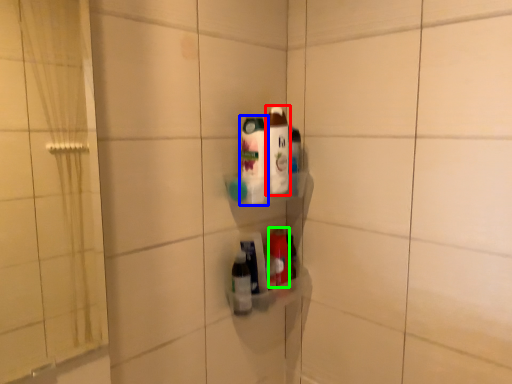
Question: Estimate the real-world distances between objects in this image. Which object is closer to bottle (highlighted by a red box), bottle (highlighted by a blue box) or bottle (highlighted by a green box)?

Choices:
 (A) bottle
 (B) bottle

Answer: (A)